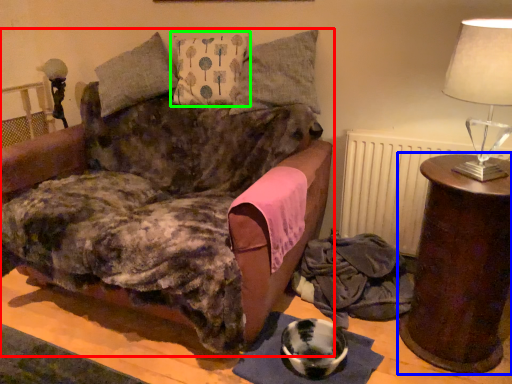
Question: Estimate the real-world distances between objects in this image. Which object is farther from furniture (highlighted by a red box), table (highlighted by a blue box) or pillow (highlighted by a green box)?

Choices:
 (A) table
 (B) pillow

Answer: (A)